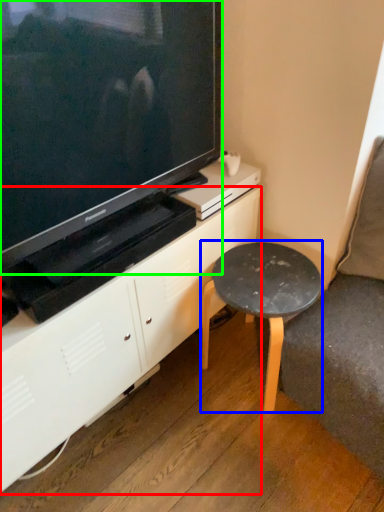
Question: Which object is positioned farthest from cabinetry (highlighted by a red box)? Select from stool (highlighted by a blue box) and television (highlighted by a green box).

Choices:
 (A) stool
 (B) television

Answer: (B)